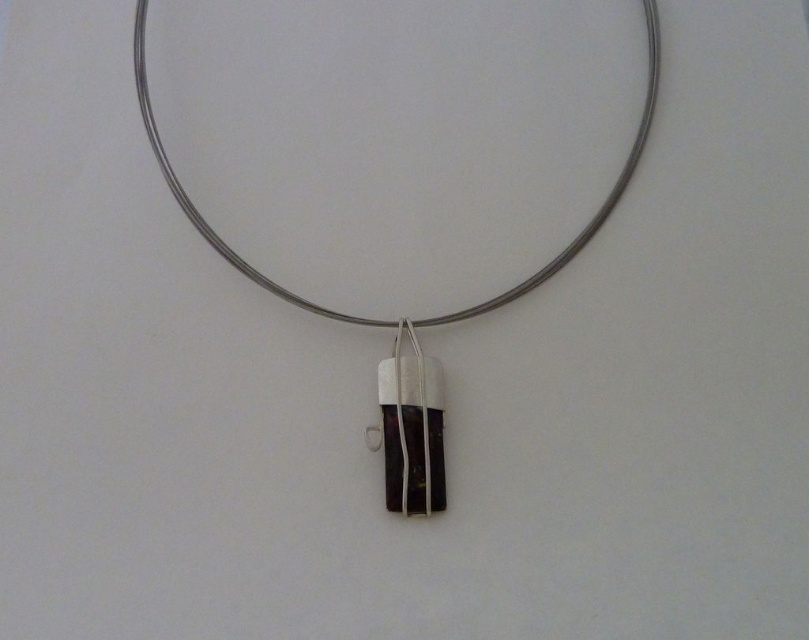
You are an app developer designing an AR feature to place virtual objects on the screen. The app uses a coordinate system where the bottom left corner is at point 0.0 and the top right corner is at point 1.0. You need to place a virtual diamond exactly above the silver wire necklace at center. What coordinate should you use for the diamond?

The silver wire necklace at center is located at point (602, 202). To place the diamond exactly above it, you should use the coordinate (524, 202) since moving upwards decreases the y coordinate in the AR system.

You are a jeweler examining a necklace design. The silver wire necklace at center has a matte silver pendant at center attached to it. Which part of the necklace would you say is bigger in size?

The silver wire necklace at center is larger in size than the matte silver pendant at center.